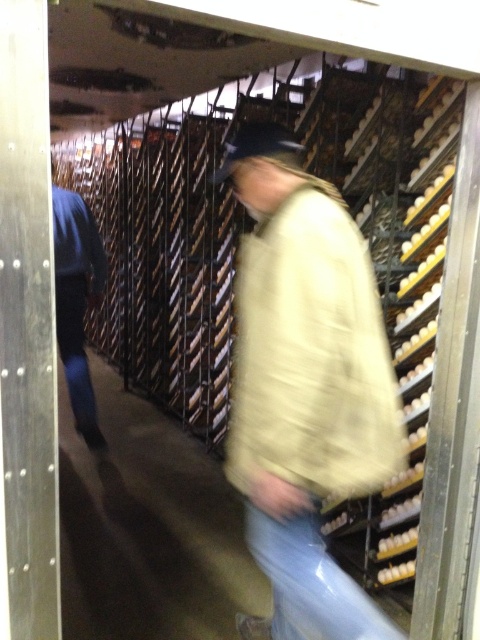
Question: Among these points, which one is nearest to the camera?

Choices:
 (A) (62, 326)
 (B) (345, 310)

Answer: (B)

Question: Is beige woolen jacket at center in front of blue denim jeans at left?

Choices:
 (A) no
 (B) yes

Answer: (B)

Question: Which point is closer to the camera?

Choices:
 (A) (60, 244)
 (B) (285, 577)

Answer: (B)

Question: From the image, what is the correct spatial relationship of beige woolen jacket at center in relation to blue denim jeans at left?

Choices:
 (A) above
 (B) below

Answer: (B)

Question: Does beige woolen jacket at center have a greater width compared to blue denim jeans at left?

Choices:
 (A) no
 (B) yes

Answer: (B)